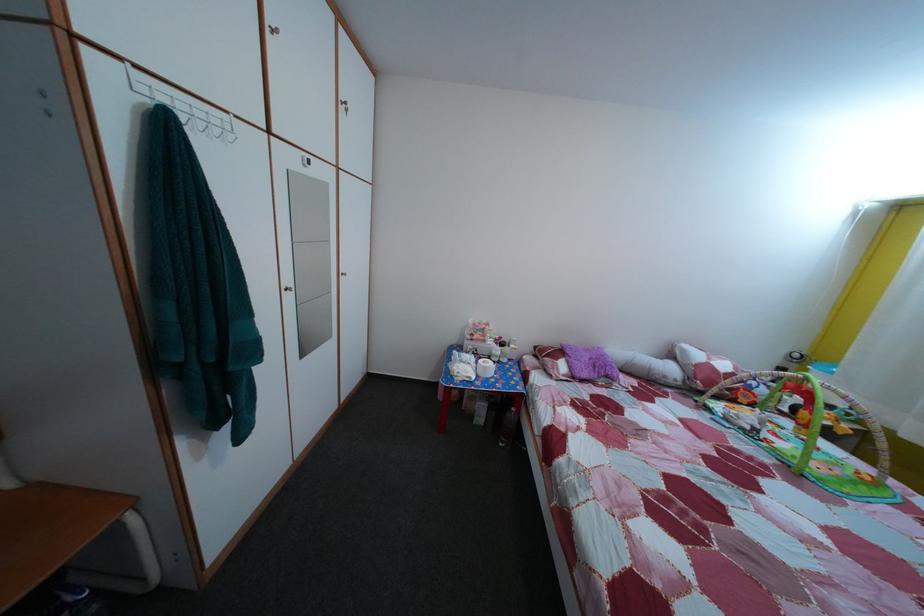
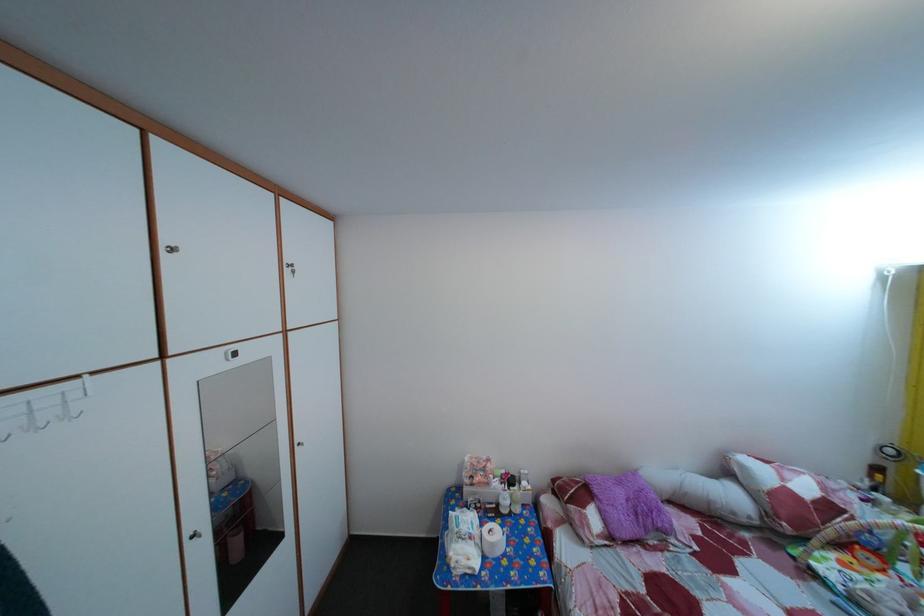
Question: The first image is from the beginning of the video and the second image is from the end. How did the camera likely rotate when shooting the video?

Choices:
 (A) Left
 (B) Right
 (C) Up
 (D) Down

Answer: (C)